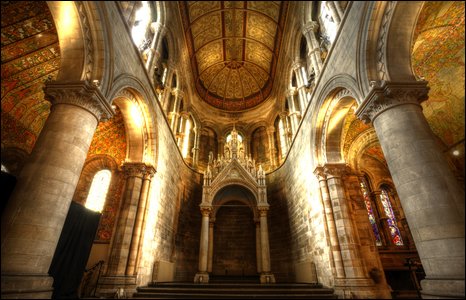
Find the location of a particular element. The height and width of the screenshot is (300, 466). ceiling is located at coordinates (241, 37).